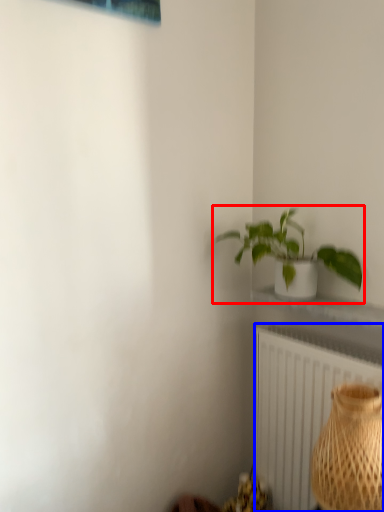
Question: Which object appears farthest to the camera in this image, houseplant (highlighted by a red box) or radiator (highlighted by a blue box)?

Choices:
 (A) houseplant
 (B) radiator

Answer: (B)